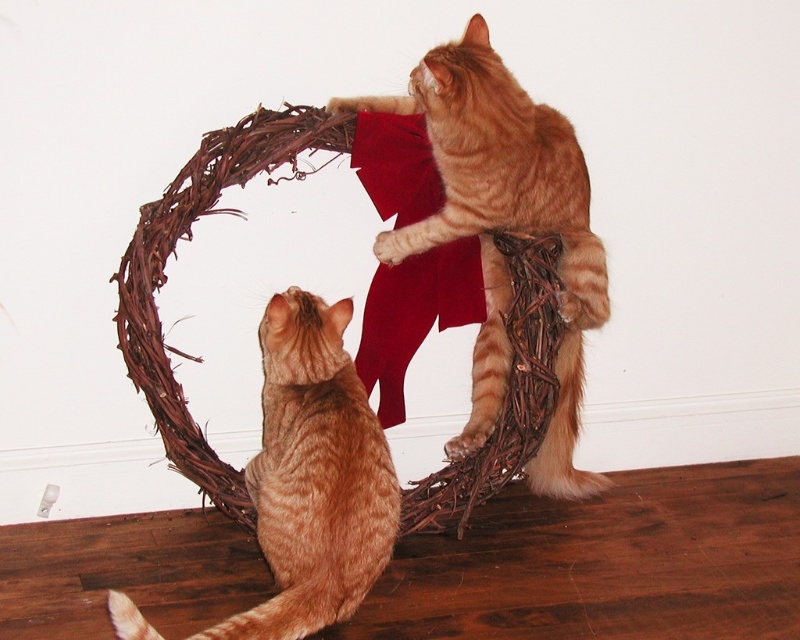
Does orange fur cat at upper center appear on the right side of orange tabby cat at center?

Indeed, orange fur cat at upper center is positioned on the right side of orange tabby cat at center.

In the scene shown: Is orange fur cat at upper center positioned before orange tabby cat at center?

No, it is not.

Is point (501, 371) positioned after point (306, 532)?

That is True.

This screenshot has width=800, height=640. Identify the location of orange fur cat at upper center. (504, 228).